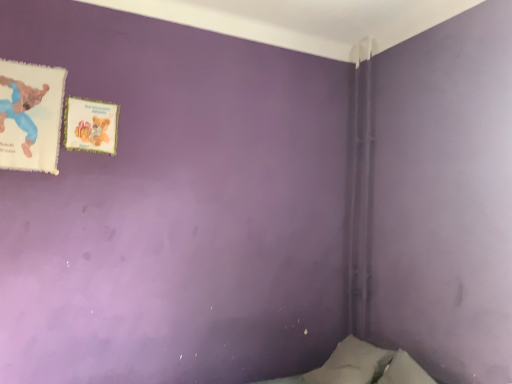
Question: Considering the positions of matte paper book at upper left, acting as the second paperback book starting from the left, and matte paper book at upper left, which is counted as the first paperback book, starting from the left, in the image, is matte paper book at upper left, acting as the second paperback book starting from the left, taller or shorter than matte paper book at upper left, which is counted as the first paperback book, starting from the left,?

Choices:
 (A) tall
 (B) short

Answer: (B)

Question: In the image, is matte paper book at upper left, which ranks as the 1th paperback book in right-to-left order, on the left side or the right side of matte paper book at upper left, marked as the second paperback book in a right-to-left arrangement?

Choices:
 (A) right
 (B) left

Answer: (A)

Question: Choose the correct answer: Is matte paper book at upper left, acting as the second paperback book starting from the left, inside matte paper book at upper left, the 2th paperback book from the back, or outside it?

Choices:
 (A) outside
 (B) inside

Answer: (A)

Question: From a real-world perspective, is matte paper book at upper left, which appears as the first paperback book when viewed from the front, positioned above or below matte paper book at upper left, which appears as the 1th paperback book when viewed from the back?

Choices:
 (A) above
 (B) below

Answer: (B)

Question: Based on their positions, is matte paper book at upper left, the 2th paperback book from the back, located to the left or right of matte paper book at upper left, which appears as the 1th paperback book when viewed from the back?

Choices:
 (A) left
 (B) right

Answer: (A)

Question: Do you think matte paper book at upper left, the 2th paperback book from the back, is within matte paper book at upper left, which ranks as the 1th paperback book in right-to-left order, or outside of it?

Choices:
 (A) inside
 (B) outside

Answer: (B)

Question: Looking at their shapes, would you say matte paper book at upper left, which is counted as the first paperback book, starting from the left, is wider or thinner than matte paper book at upper left, which appears as the 1th paperback book when viewed from the back?

Choices:
 (A) wide
 (B) thin

Answer: (A)